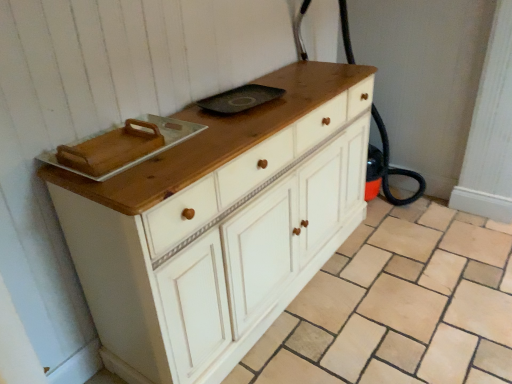
Question: Is white wood cabinet at center wider than white wood chest of drawers at center?

Choices:
 (A) yes
 (B) no

Answer: (A)

Question: Is white wood cabinet at center not within white wood chest of drawers at center?

Choices:
 (A) no
 (B) yes

Answer: (B)

Question: Considering the relative sizes of white wood cabinet at center and white wood chest of drawers at center in the image provided, is white wood cabinet at center thinner than white wood chest of drawers at center?

Choices:
 (A) no
 (B) yes

Answer: (A)

Question: From the image's perspective, is white wood cabinet at center located above white wood chest of drawers at center?

Choices:
 (A) no
 (B) yes

Answer: (A)

Question: From the image's perspective, is white wood cabinet at center below white wood chest of drawers at center?

Choices:
 (A) yes
 (B) no

Answer: (A)

Question: Is white wood cabinet at center oriented towards white wood chest of drawers at center?

Choices:
 (A) yes
 (B) no

Answer: (A)

Question: From the image's perspective, is white wood chest of drawers at center over white wood cabinet at center?

Choices:
 (A) no
 (B) yes

Answer: (B)

Question: From the image's perspective, is white wood chest of drawers at center under white wood cabinet at center?

Choices:
 (A) no
 (B) yes

Answer: (A)

Question: Is white wood chest of drawers at center looking in the opposite direction of white wood cabinet at center?

Choices:
 (A) no
 (B) yes

Answer: (A)

Question: Considering the relative sizes of white wood chest of drawers at center and white wood cabinet at center in the image provided, is white wood chest of drawers at center bigger than white wood cabinet at center?

Choices:
 (A) yes
 (B) no

Answer: (A)

Question: Can you confirm if white wood chest of drawers at center is shorter than white wood cabinet at center?

Choices:
 (A) no
 (B) yes

Answer: (A)

Question: Is white wood chest of drawers at center smaller than white wood cabinet at center?

Choices:
 (A) yes
 (B) no

Answer: (B)

Question: In terms of size, does white wood chest of drawers at center appear bigger or smaller than white wood cabinet at center?

Choices:
 (A) big
 (B) small

Answer: (A)